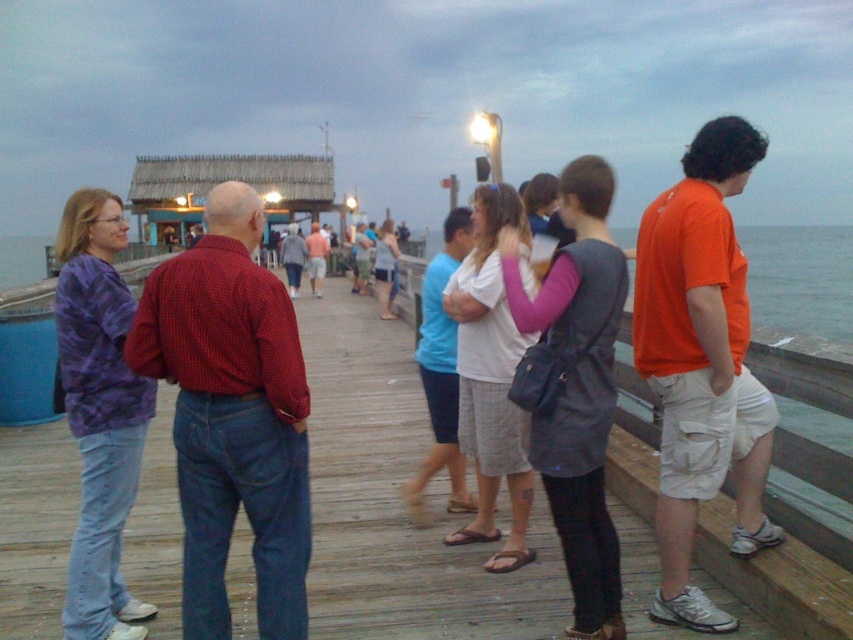
In the scene shown: Between orange fabric shorts at right and white cotton shirt at center, which one appears on the left side from the viewer's perspective?

white cotton shirt at center is more to the left.

Is the position of orange fabric shorts at right more distant than that of white cotton shirt at center?

Yes, orange fabric shorts at right is further from the viewer.

What do you see at coordinates (805, 372) in the screenshot? I see `orange fabric shorts at right` at bounding box center [805, 372].

Locate an element on the screen. orange fabric shorts at right is located at coordinates (805, 372).

Consider the image. Measure the distance from red checkered shirt at center to purple tie-dye sweater at left.

red checkered shirt at center is 94.54 centimeters from purple tie-dye sweater at left.

Which of these two, red checkered shirt at center or purple tie-dye sweater at left, stands taller?

purple tie-dye sweater at left is taller.

Between point (210, 451) and point (90, 289), which one is positioned behind?

Positioned behind is point (90, 289).

Where is `red checkered shirt at center`? The image size is (853, 640). red checkered shirt at center is located at coordinates (231, 416).

Consider the image. Who is shorter, purple tie-dye sweater at left or matte blue shirt at center?

matte blue shirt at center

Which of these two, purple tie-dye sweater at left or matte blue shirt at center, stands taller?

With more height is purple tie-dye sweater at left.

Who is more distant from viewer, (102, 611) or (436, 376)?

The point (436, 376) is more distant.

Find the location of a particular element. This screenshot has width=853, height=640. purple tie-dye sweater at left is located at coordinates (99, 413).